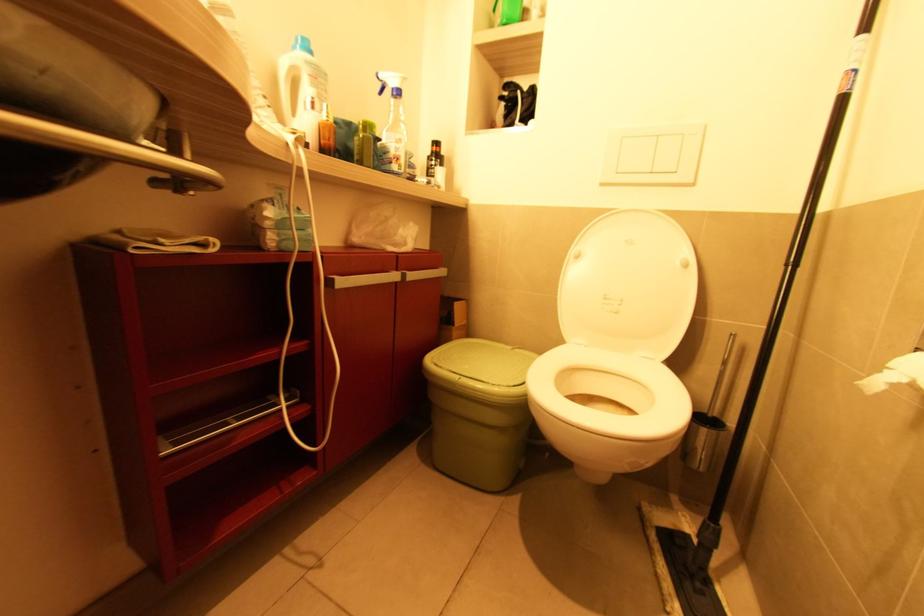
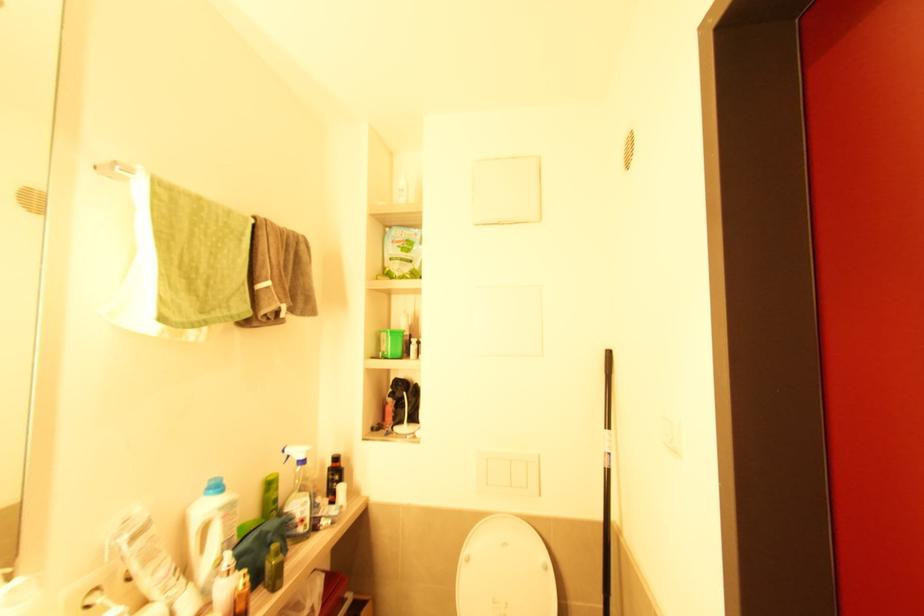
The point at [310,76] is marked in the first image. Where is the corresponding point in the second image?

(224, 519)